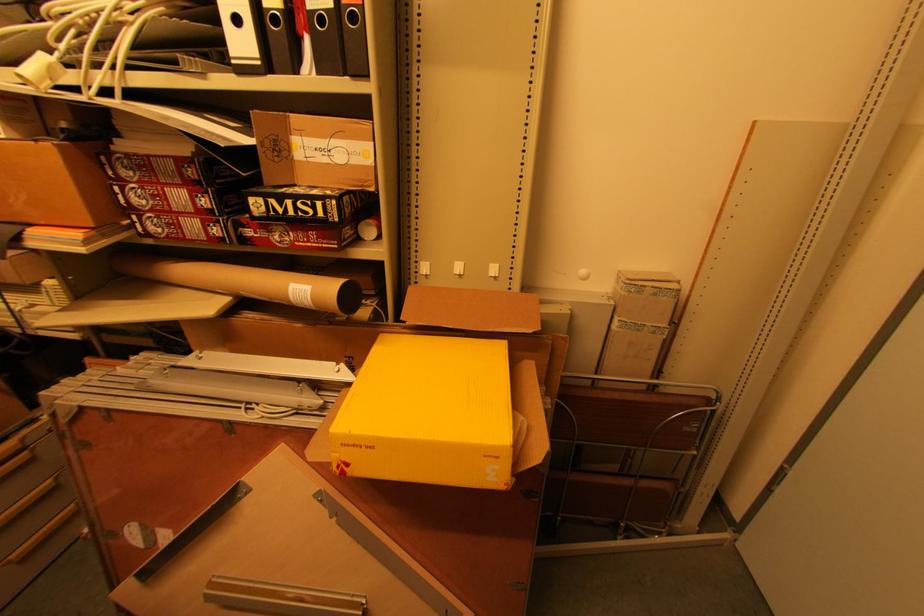
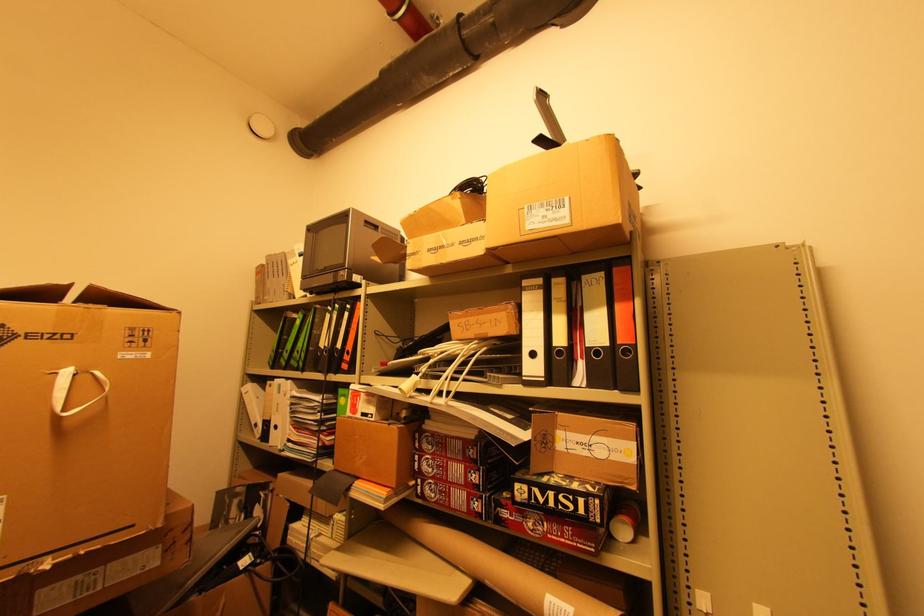
The point at (307, 204) is marked in the first image. Where is the corresponding point in the second image?

(568, 498)